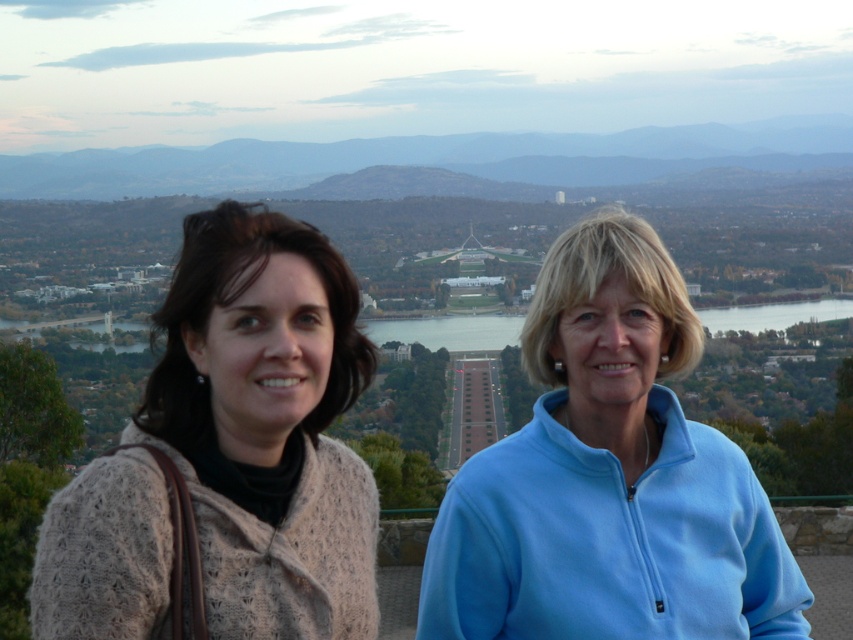
You are a photographer planning to take a portrait of the two people in the image. You want to ensure that both the knitted beige sweater at left and the blue fleece jacket at center are clearly visible in the frame. Based on their positions, which clothing item is lower in the image?

The knitted beige sweater at left is below the blue fleece jacket at center, so the knitted beige sweater at left is lower in the image.

You are a photographer planning to take a group photo of the two people in the scene. The minimum distance required between the subjects for optimal focus is 10 meters. Can you confirm if the distance between the knitted beige sweater at left and the blue fleece jacket at center meets this requirement?

The knitted beige sweater at left and blue fleece jacket at center are 10.43 meters apart from each other, which exceeds the 10 meter requirement. Therefore, the distance between the knitted beige sweater at left and the blue fleece jacket at center is sufficient for optimal focus.